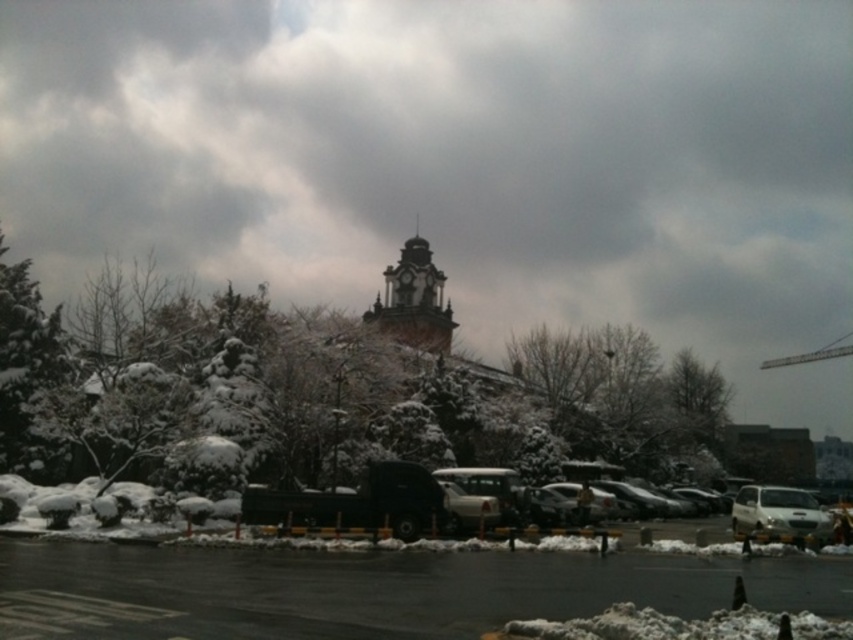
Question: Among these points, which one is nearest to the camera?

Choices:
 (A) (39, 321)
 (B) (286, 608)

Answer: (B)

Question: Is gray cloudy sky at upper center in front of dark gray stone clock tower at center?

Choices:
 (A) yes
 (B) no

Answer: (B)

Question: Is gray cloudy sky at upper center wider than snow-covered tree at center?

Choices:
 (A) no
 (B) yes

Answer: (B)

Question: Which of the following is the farthest from the observer?

Choices:
 (A) (141, 323)
 (B) (514, 72)

Answer: (B)

Question: Is black asphalt parking lot at lower center above white snow-covered tree at left?

Choices:
 (A) no
 (B) yes

Answer: (A)

Question: Which point is closer to the camera?

Choices:
 (A) (309, 403)
 (B) (403, 257)
 (C) (759, 506)
 (D) (15, 397)

Answer: (C)